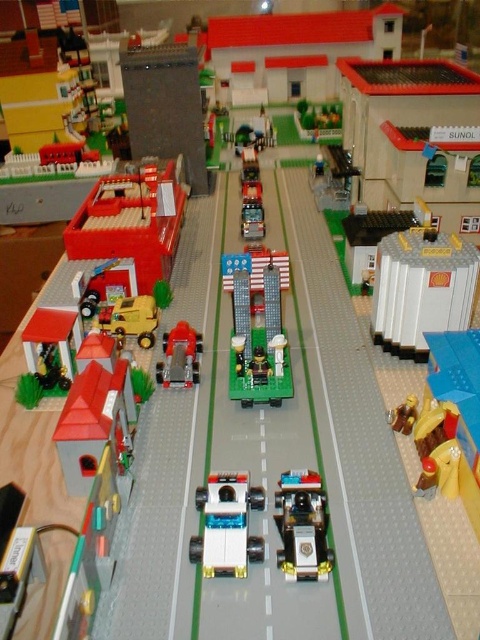
You are standing in the Lego city and want to place a new Lego piece between the two points, point (196, 492) and point (302, 515). Which point is closer to you so you can start placing the piece from there?

Point (196, 492) is closer to you than point (302, 515), so you should start placing the piece from there.

You are a Lego figure standing on the road in the Lego cityscape. You see a translucent white plastic car at center and a shiny black police car at center. Which car is positioned lower in the scene?

The translucent white plastic car at center is positioned below the shiny black police car at center, so it is lower in the scene.

You are a Lego figure standing at the edge of the Lego city. You see the metallic silver train at center and the translucent white plastic car at center. Which one is closer to you?

The metallic silver train at center is closer to you because the translucent white plastic car at center is behind it.